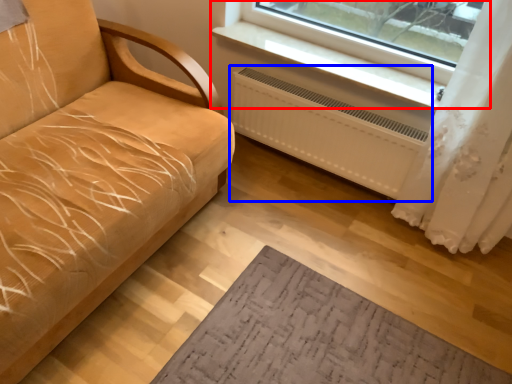
Question: Which of the following is the farthest to the observer, window (highlighted by a red box) or radiator (highlighted by a blue box)?

Choices:
 (A) window
 (B) radiator

Answer: (B)